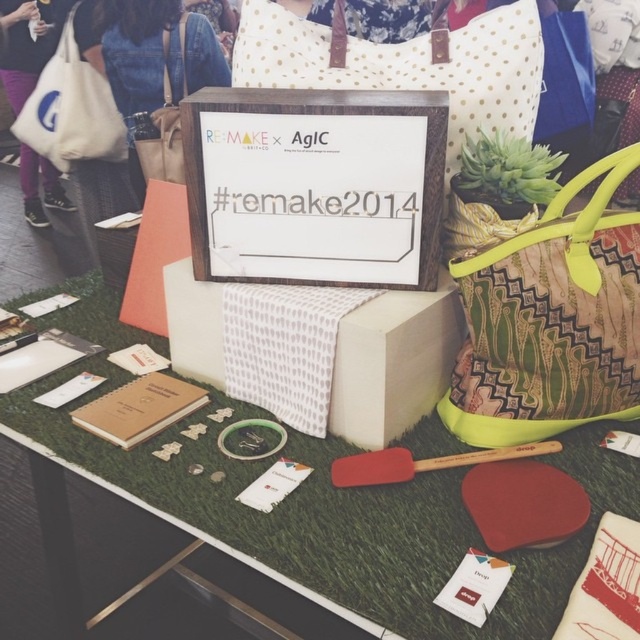
Question: Observing the image, what is the correct spatial positioning of white dotted pillow at upper center in reference to matte beige tote at upper left?

Choices:
 (A) right
 (B) left

Answer: (A)

Question: Which point is farther to the camera?

Choices:
 (A) click(157, 156)
 (B) click(442, 625)
 (C) click(637, 228)
 (D) click(364, 74)

Answer: (A)

Question: Which point appears farthest from the camera in this image?

Choices:
 (A) (72, 154)
 (B) (516, 109)
 (C) (154, 141)
 (D) (538, 353)

Answer: (A)

Question: Is matte white box at center above white dotted pillow at upper center?

Choices:
 (A) no
 (B) yes

Answer: (A)

Question: Is matte white box at center smaller than white dotted pillow at upper center?

Choices:
 (A) no
 (B) yes

Answer: (A)

Question: Which point is closer to the camera?

Choices:
 (A) matte white box at center
 (B) white canvas tote at upper left
 (C) green patterned fabric bag at center
 (D) matte beige tote at upper left

Answer: (A)